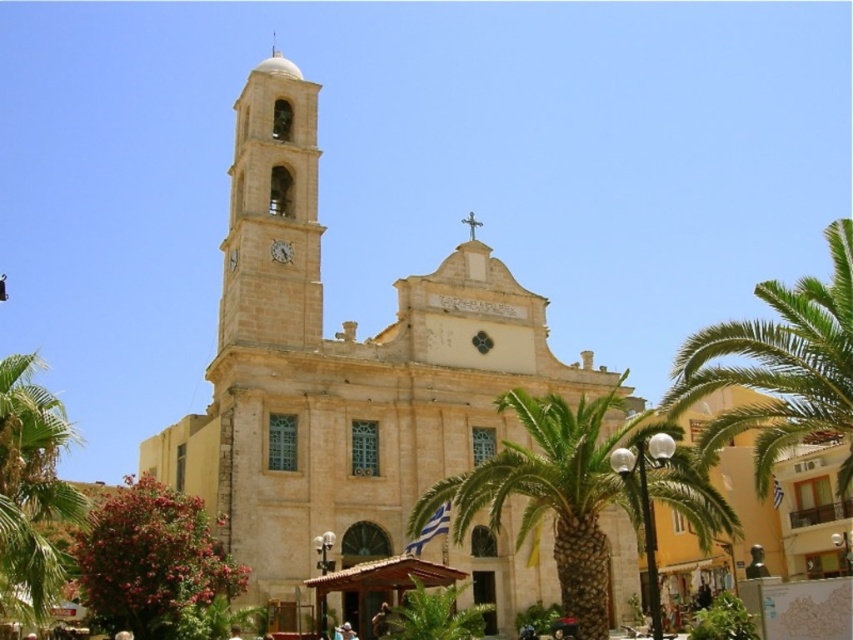
You are a photographer planning to capture the beige stone church at center and the green leafy palm tree at center in a single frame. Based on their sizes, which object will appear more prominent in the photo?

The beige stone church at center is larger in size than the green leafy palm tree at center, so it will appear more prominent in the photo.

You are standing in front of the beige stone church at center and the green leafy palm tree at center. Which object is closer to you?

The beige stone church at center is closer to you because it is positioned over the green leafy palm tree at center, indicating it is in front.